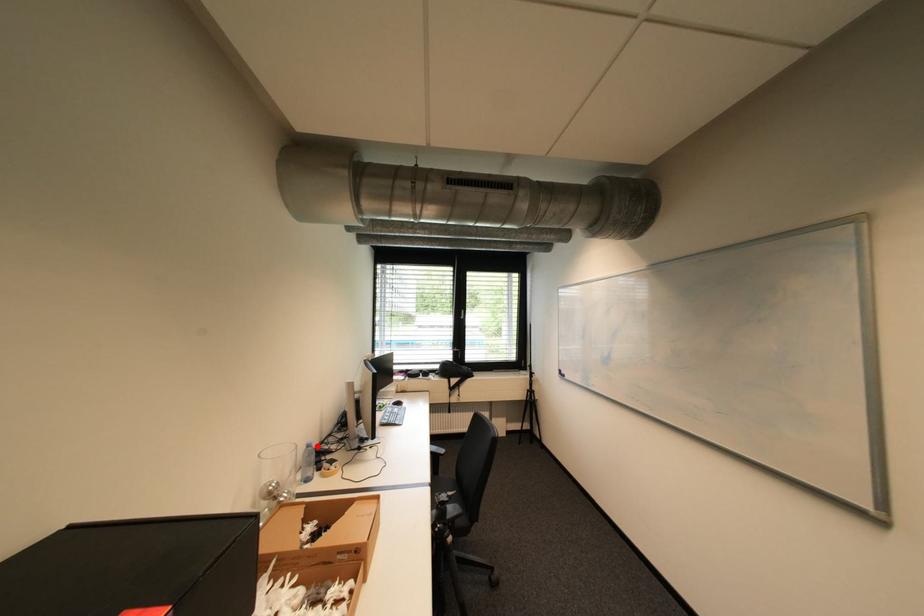
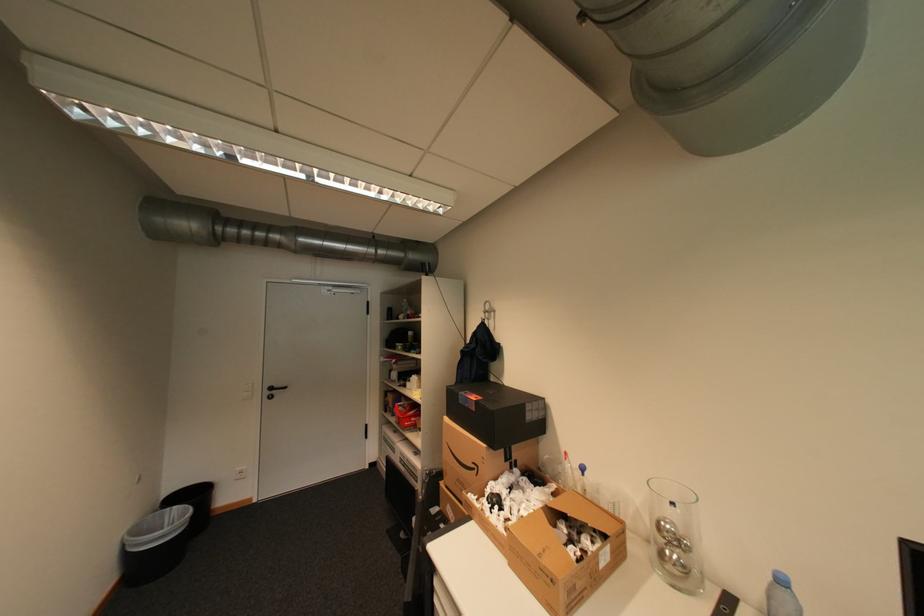
Question: A red point is marked in image1. In image2, is the corresponding 3D point closer to the camera or farther? Reply with the corresponding letter.

Choices:
 (A) The corresponding 3D point is closer.
 (B) The corresponding 3D point is farther.

Answer: (B)